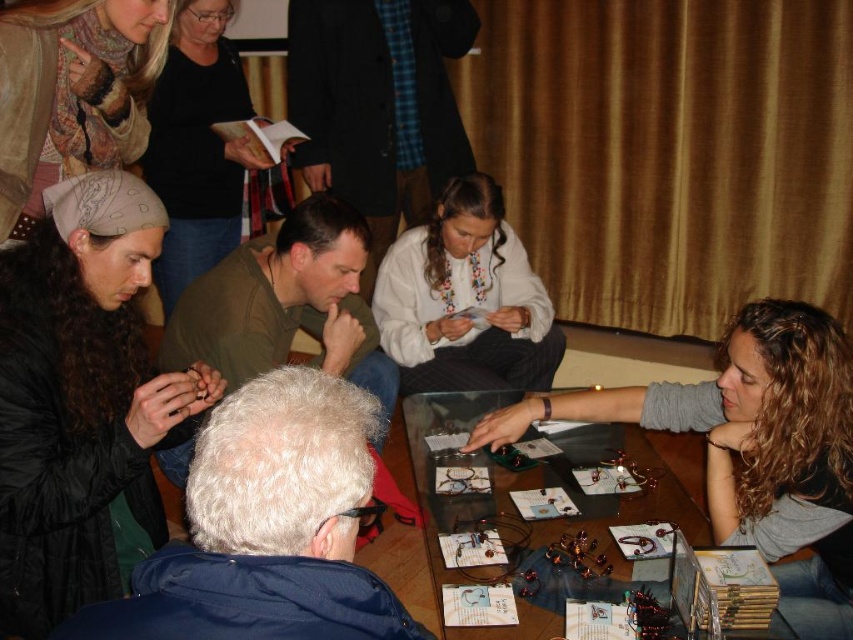
Question: Is transparent glass table at center wider than patterned scarf at upper left?

Choices:
 (A) yes
 (B) no

Answer: (A)

Question: Which point is closer to the camera taking this photo?

Choices:
 (A) (62, 198)
 (B) (61, 168)
 (C) (469, 268)
 (D) (428, 460)

Answer: (A)

Question: Estimate the real-world distances between objects in this image. Which object is closer to the black fabric shirt at upper center?

Choices:
 (A) patterned scarf at upper left
 (B) transparent glass table at center

Answer: (A)

Question: Which of the following is the closest to the observer?

Choices:
 (A) (148, 51)
 (B) (225, 150)
 (C) (421, 452)

Answer: (A)

Question: Is matte black hair at upper left smaller than transparent glass table at center?

Choices:
 (A) yes
 (B) no

Answer: (A)

Question: Can you confirm if transparent glass table at center is positioned below white embroidered blouse at center?

Choices:
 (A) no
 (B) yes

Answer: (B)